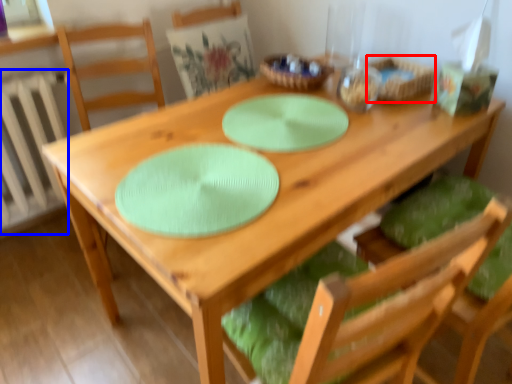
Question: Among these objects, which one is farthest to the camera, basket (highlighted by a red box) or radiator (highlighted by a blue box)?

Choices:
 (A) basket
 (B) radiator

Answer: (B)